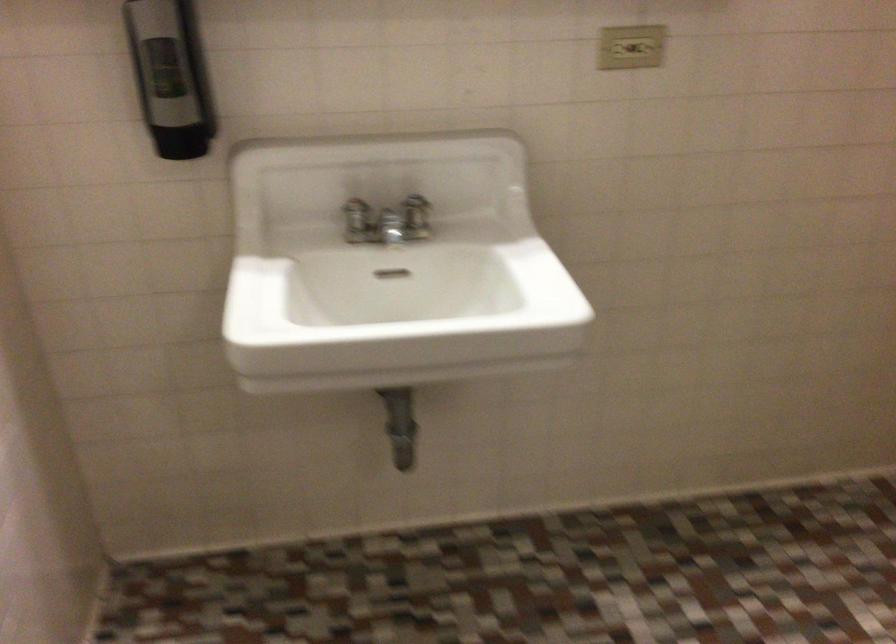
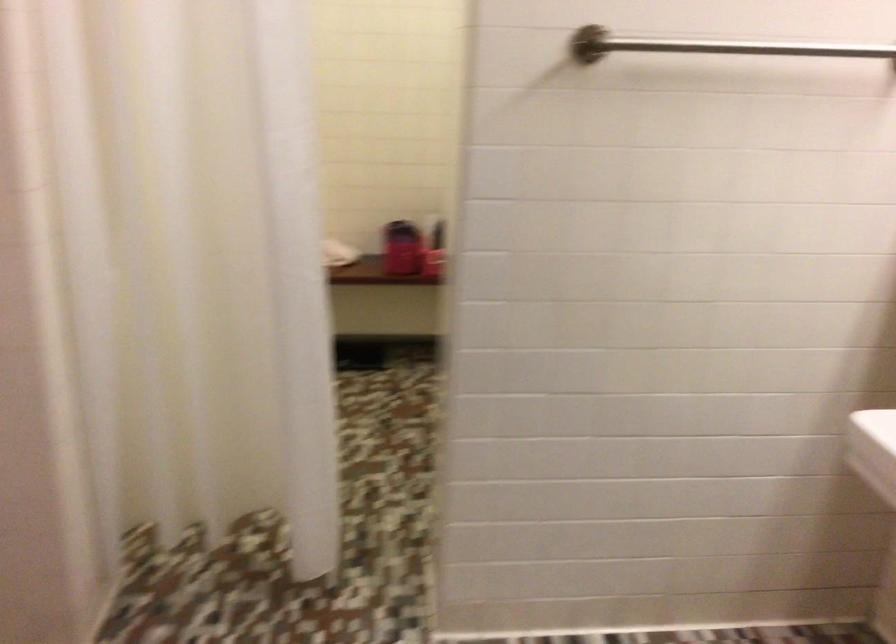
First-person continuous shooting, in which direction is the camera rotating?

The camera rotated toward left-down.